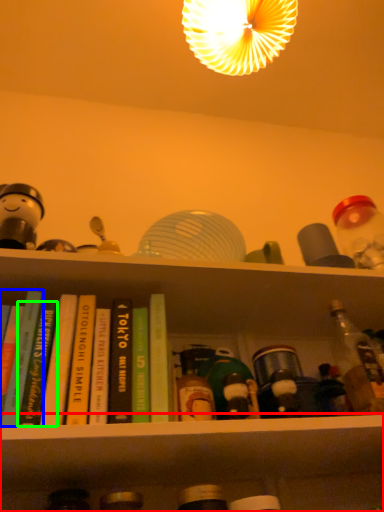
Question: Estimate the real-world distances between objects in this image. Which object is closer to shelf (highlighted by a red box), book (highlighted by a blue box) or book (highlighted by a green box)?

Choices:
 (A) book
 (B) book

Answer: (B)